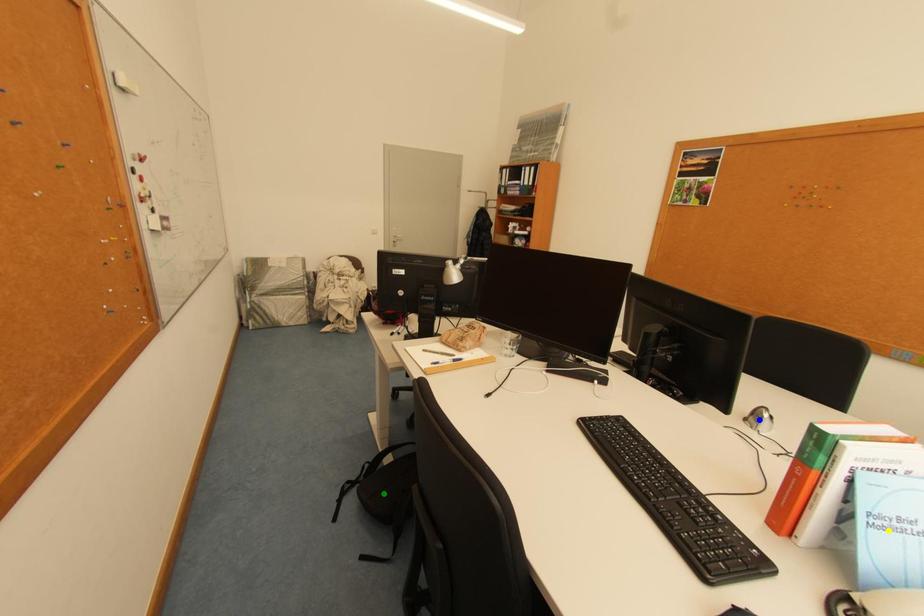
Order these from nearest to farthest:
- yellow point
- blue point
- green point

yellow point, blue point, green point